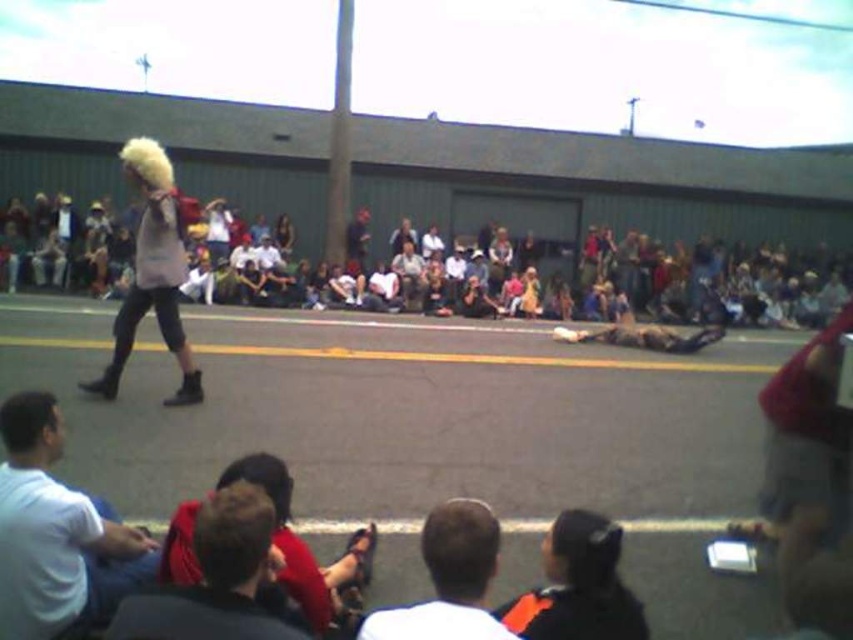
You are a photographer standing at the edge of the street scene. You want to take a photo of the fuzzy white wig at left without the white cotton shirt at lower left blocking it. Is this possible?

The white cotton shirt at lower left is in front of the fuzzy white wig at left, so it will block the view. Move to a position where the white cotton shirt at lower left is not between you and the fuzzy white wig at left to capture the wig without obstruction.